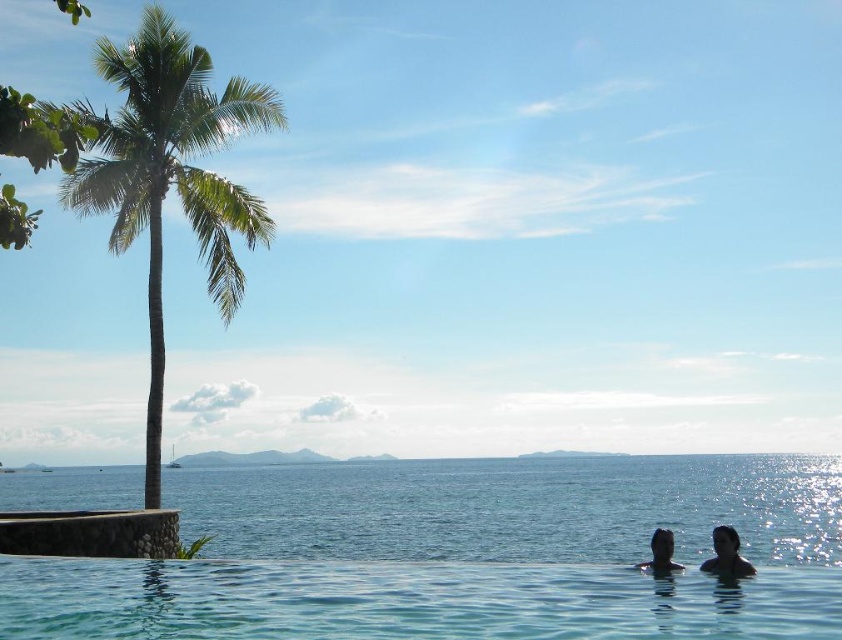
Locate an element on the screen. clear blue water at center is located at coordinates (461, 554).

Is clear blue water at center positioned before smooth skin head at lower right?

Yes, it is in front of smooth skin head at lower right.

Is point (797, 552) in front of point (718, 561)?

No, (797, 552) is further to viewer.

The width and height of the screenshot is (842, 640). I want to click on clear blue water at center, so click(x=461, y=554).

Can you confirm if green leafy palm tree at left is positioned below black matte head at lower right?

Actually, green leafy palm tree at left is above black matte head at lower right.

Can you confirm if green leafy palm tree at left is positioned to the left of black matte head at lower right?

Correct, you'll find green leafy palm tree at left to the left of black matte head at lower right.

I want to click on green leafy palm tree at left, so click(169, 173).

This screenshot has height=640, width=842. In order to click on green leafy palm tree at left in this screenshot , I will do `click(169, 173)`.

Does dark skin human at lower right appear under black matte head at lower right?

Actually, dark skin human at lower right is above black matte head at lower right.

The width and height of the screenshot is (842, 640). Identify the location of dark skin human at lower right. (726, 554).